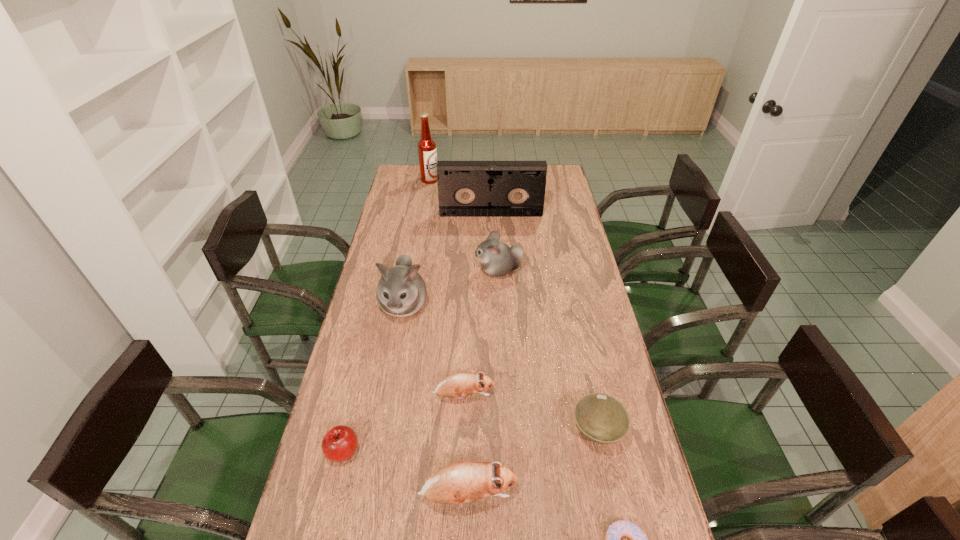
Where is `the farthest object`? The width and height of the screenshot is (960, 540). the farthest object is located at coordinates (427, 153).

The image size is (960, 540). I want to click on the tallest object, so click(x=427, y=153).

The width and height of the screenshot is (960, 540). I want to click on black videotape, so click(465, 188).

Where is `videotape`? videotape is located at coordinates (465, 188).

Where is `the left white hamster`? the left white hamster is located at coordinates (401, 292).

This screenshot has width=960, height=540. Identify the location of the third nearest hamster. (401, 292).

Where is `the right white hamster`? The height and width of the screenshot is (540, 960). the right white hamster is located at coordinates (497, 259).

The height and width of the screenshot is (540, 960). Identify the location of the smaller white hamster. (497, 259).

This screenshot has width=960, height=540. What are the coordinates of `the nearer brown hamster` in the screenshot? It's located at coord(460,482).

Image resolution: width=960 pixels, height=540 pixels. Identify the location of the fifth shortest object. (460, 482).